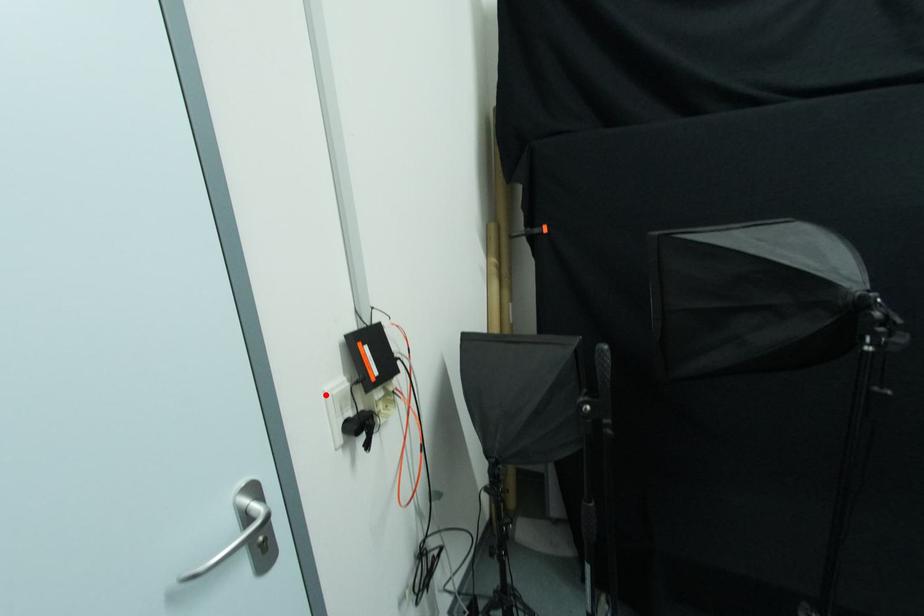
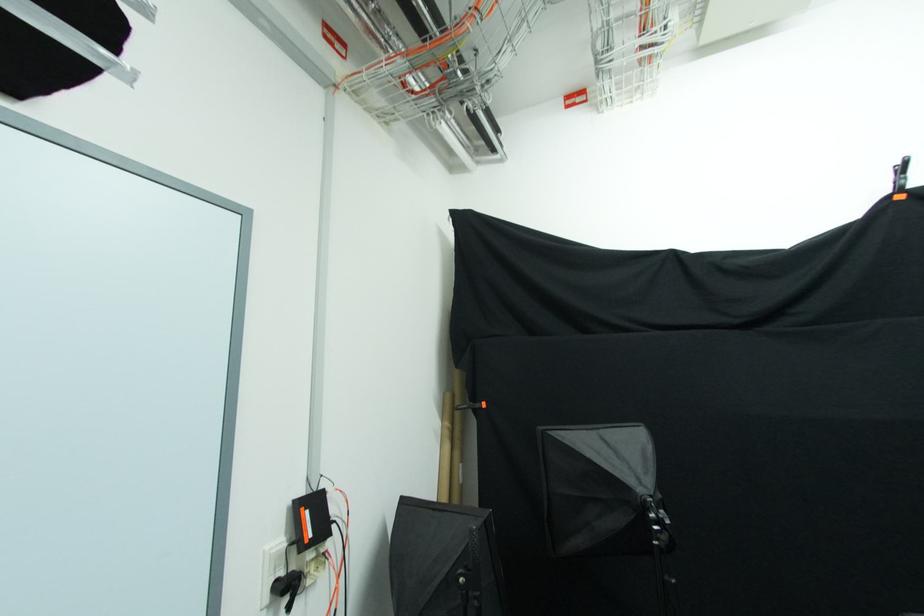
The point at the highlighted location is marked in the first image. Where is the corresponding point in the second image?

(266, 554)